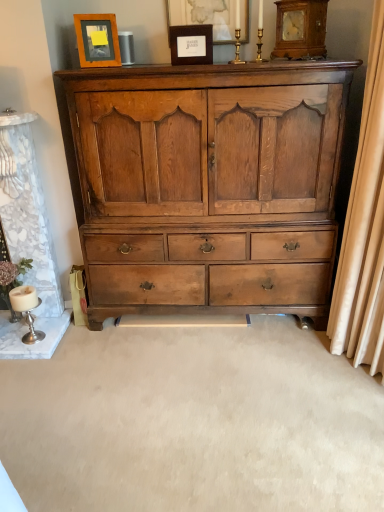
Question: Is matte black picture frame at upper center, placed as the second picture frame when sorted from right to left, taller than wooden picture frame at upper center, which ranks as the third picture frame in left-to-right order?

Choices:
 (A) no
 (B) yes

Answer: (A)

Question: Is matte black picture frame at upper center, placed as the 2th picture frame when sorted from left to right, touching wooden picture frame at upper center, which is counted as the 1th picture frame, starting from the right?

Choices:
 (A) no
 (B) yes

Answer: (A)

Question: Does matte black picture frame at upper center, placed as the 2th picture frame when sorted from left to right, have a smaller size compared to wooden picture frame at upper center, which ranks as the third picture frame in left-to-right order?

Choices:
 (A) yes
 (B) no

Answer: (B)

Question: Can you confirm if matte black picture frame at upper center, placed as the 2th picture frame when sorted from left to right, is bigger than wooden picture frame at upper center, which is counted as the 1th picture frame, starting from the right?

Choices:
 (A) yes
 (B) no

Answer: (A)

Question: Considering the relative sizes of matte black picture frame at upper center, placed as the second picture frame when sorted from right to left, and wooden picture frame at upper center, which is counted as the 1th picture frame, starting from the right, in the image provided, is matte black picture frame at upper center, placed as the second picture frame when sorted from right to left, thinner than wooden picture frame at upper center, which is counted as the 1th picture frame, starting from the right,?

Choices:
 (A) no
 (B) yes

Answer: (A)

Question: Is matte black picture frame at upper center, placed as the 2th picture frame when sorted from left to right, facing towards wooden picture frame at upper center, which ranks as the third picture frame in left-to-right order?

Choices:
 (A) yes
 (B) no

Answer: (B)

Question: Is beige fabric curtain at right located within wooden frame at upper left, the 1th picture frame viewed from the left?

Choices:
 (A) no
 (B) yes

Answer: (A)

Question: Is wooden frame at upper left, the 1th picture frame viewed from the left, taller than beige fabric curtain at right?

Choices:
 (A) yes
 (B) no

Answer: (B)

Question: From the image's perspective, is wooden frame at upper left, the 1th picture frame viewed from the left, below beige fabric curtain at right?

Choices:
 (A) yes
 (B) no

Answer: (B)

Question: Is wooden frame at upper left, the 1th picture frame viewed from the left, positioned in front of beige fabric curtain at right?

Choices:
 (A) yes
 (B) no

Answer: (B)

Question: Is wooden frame at upper left, the 1th picture frame viewed from the left, at the left side of beige fabric curtain at right?

Choices:
 (A) no
 (B) yes

Answer: (B)

Question: Can you confirm if wooden frame at upper left, which is the 3th picture frame from right to left, is positioned to the right of beige fabric curtain at right?

Choices:
 (A) yes
 (B) no

Answer: (B)

Question: Can you confirm if beige fabric curtain at right is wider than wooden frame at upper left, which is the 3th picture frame from right to left?

Choices:
 (A) no
 (B) yes

Answer: (B)